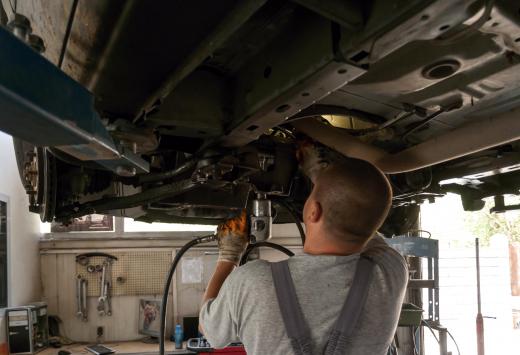
The width and height of the screenshot is (520, 355). I want to click on workbench, so click(355, 298), click(144, 342).